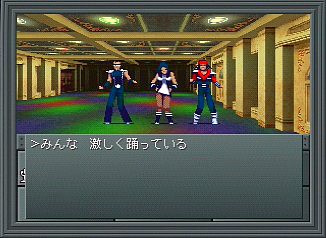
Locate an element on the screen. This screenshot has width=326, height=238. green spots in floor is located at coordinates (187, 108), (188, 93), (140, 100), (79, 112), (61, 98), (115, 126).